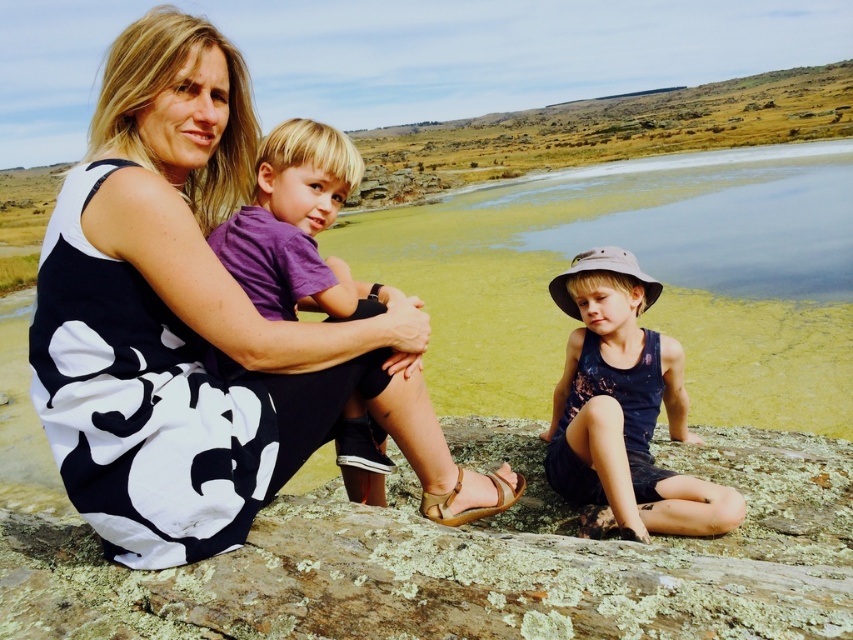
At what (x,y) coordinates should I click in order to perform the action: click on lichen-covered rock at center. Please return your answer as a coordinate pair (x, y). Image resolution: width=853 pixels, height=640 pixels. Looking at the image, I should click on (474, 561).

In order to click on lichen-covered rock at center in this screenshot , I will do `click(474, 561)`.

Image resolution: width=853 pixels, height=640 pixels. Find the location of `black floral dress at center`. black floral dress at center is located at coordinates (200, 324).

Locate an element on the screen. Image resolution: width=853 pixels, height=640 pixels. black floral dress at center is located at coordinates (200, 324).

How distant is black floral dress at center from purple cotton shirt at center?

black floral dress at center is 70.18 centimeters away from purple cotton shirt at center.

Does black floral dress at center have a lesser width compared to purple cotton shirt at center?

No.

Image resolution: width=853 pixels, height=640 pixels. Describe the element at coordinates (200, 324) in the screenshot. I see `black floral dress at center` at that location.

Find the location of `black floral dress at center`. black floral dress at center is located at coordinates (200, 324).